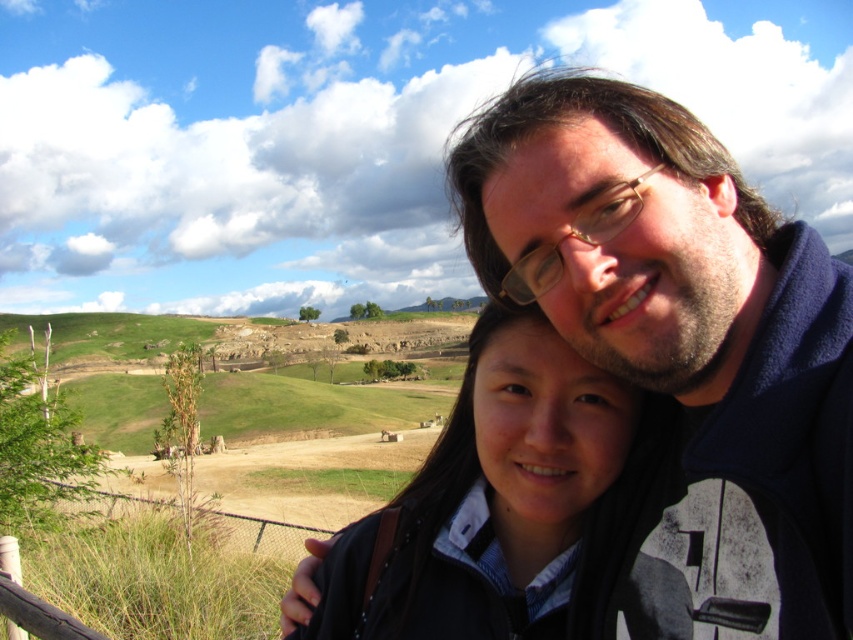
Question: Which point appears farthest from the camera in this image?

Choices:
 (A) (468, 376)
 (B) (706, 408)

Answer: (A)

Question: Can you confirm if dark blue fleece at upper right is positioned to the right of dark brown hair at center?

Choices:
 (A) yes
 (B) no

Answer: (A)

Question: In this image, where is dark blue fleece at upper right located relative to dark brown hair at center?

Choices:
 (A) below
 (B) above

Answer: (B)

Question: Which point is closer to the camera taking this photo?

Choices:
 (A) (514, 132)
 (B) (555, 474)

Answer: (A)

Question: Does dark blue fleece at upper right lie in front of dark brown hair at center?

Choices:
 (A) yes
 (B) no

Answer: (A)